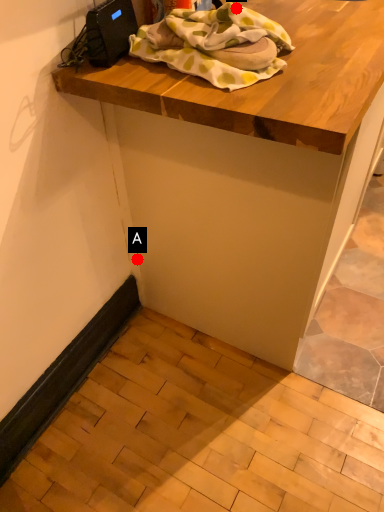
Question: Two points are circled on the image, labeled by A and B beside each circle. Which point appears farthest from the camera in this image?

Choices:
 (A) A is further
 (B) B is further

Answer: (A)